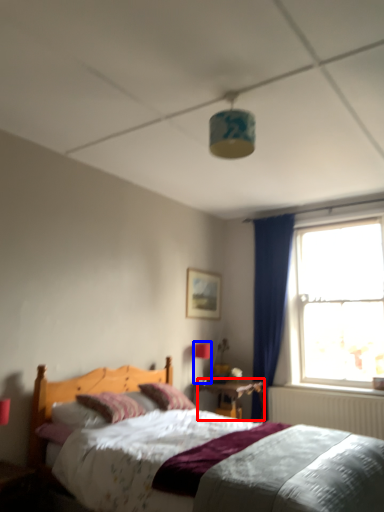
Question: Among these objects, which one is farthest to the camera, nightstand (highlighted by a red box) or light fixture (highlighted by a blue box)?

Choices:
 (A) nightstand
 (B) light fixture

Answer: (B)